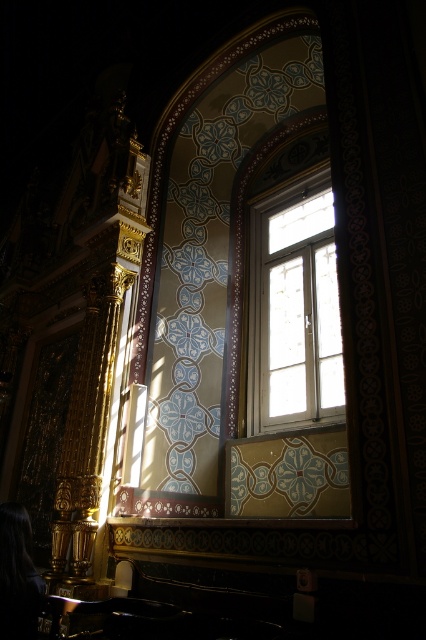
Question: Which of the following is the closest to the observer?

Choices:
 (A) (279, 374)
 (B) (8, 616)

Answer: (B)

Question: Does clear glass window at center lie in front of black hair at lower left?

Choices:
 (A) no
 (B) yes

Answer: (A)

Question: Which of the following is the farthest from the observer?

Choices:
 (A) (17, 632)
 (B) (284, 388)

Answer: (B)

Question: Which of the following is the closest to the observer?

Choices:
 (A) (19, 518)
 (B) (319, 380)

Answer: (A)

Question: Observing the image, what is the correct spatial positioning of clear glass window at center in reference to black hair at lower left?

Choices:
 (A) right
 (B) left

Answer: (A)

Question: Can you confirm if clear glass window at center is smaller than black hair at lower left?

Choices:
 (A) yes
 (B) no

Answer: (B)